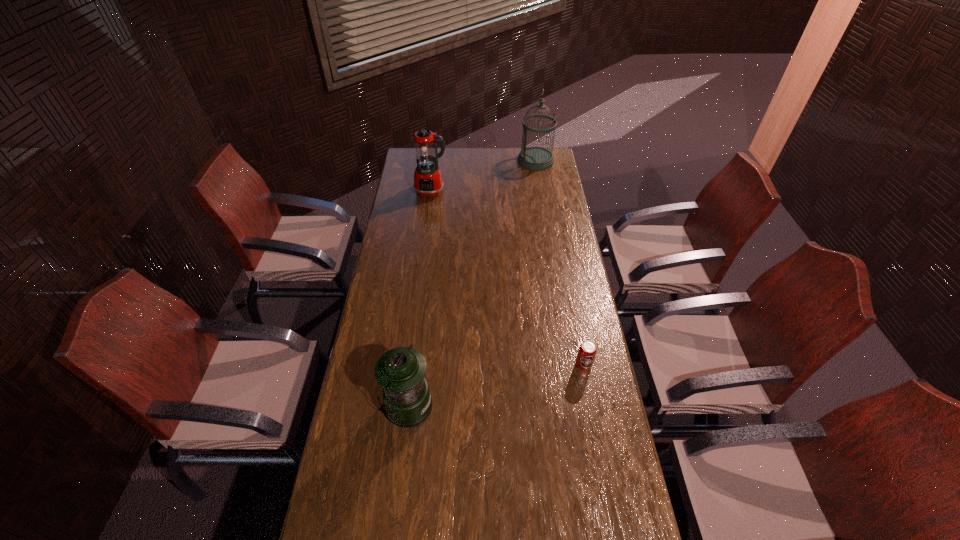
Find the location of a particular element. The width and height of the screenshot is (960, 540). vacant space that satisfies the following two spatial constraints: 1. on the controls of the second farthest object; 2. on the left side of the third farthest object is located at coordinates (408, 364).

I want to click on vacant space that satisfies the following two spatial constraints: 1. on the front-facing side of the birdcage; 2. on the controls of the second tallest object, so click(541, 192).

Where is `blank space that satisfies the following two spatial constraints: 1. on the front-facing side of the birdcage; 2. on the controls of the second farthest object`? blank space that satisfies the following two spatial constraints: 1. on the front-facing side of the birdcage; 2. on the controls of the second farthest object is located at coordinates pos(541,192).